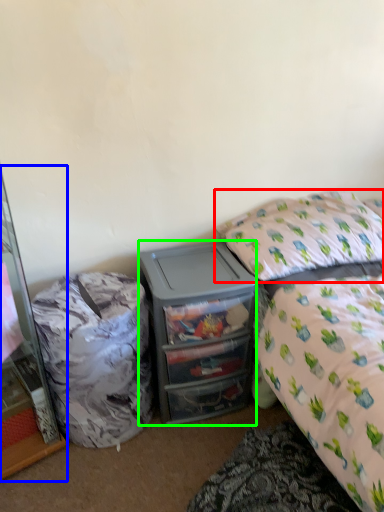
Question: Which is farther away from pillow (highlighted by a red box)? cabinetry (highlighted by a blue box) or desk (highlighted by a green box)?

Choices:
 (A) cabinetry
 (B) desk

Answer: (A)